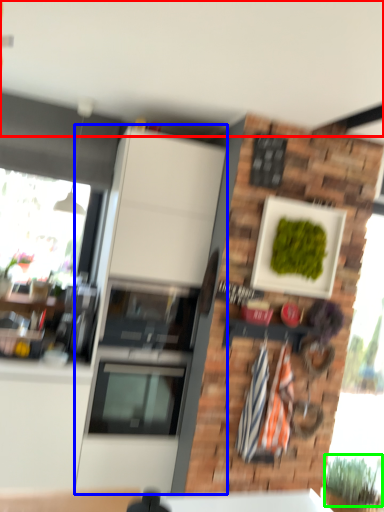
Question: Which is nearer to the backdrop (highlighted by a red box)? cabinetry (highlighted by a blue box) or plant (highlighted by a green box).

Choices:
 (A) cabinetry
 (B) plant

Answer: (A)